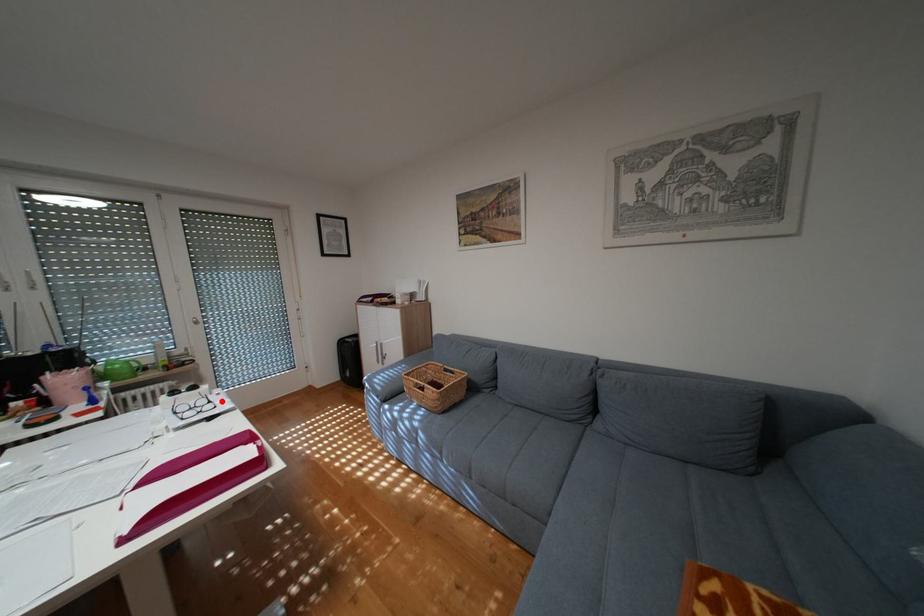
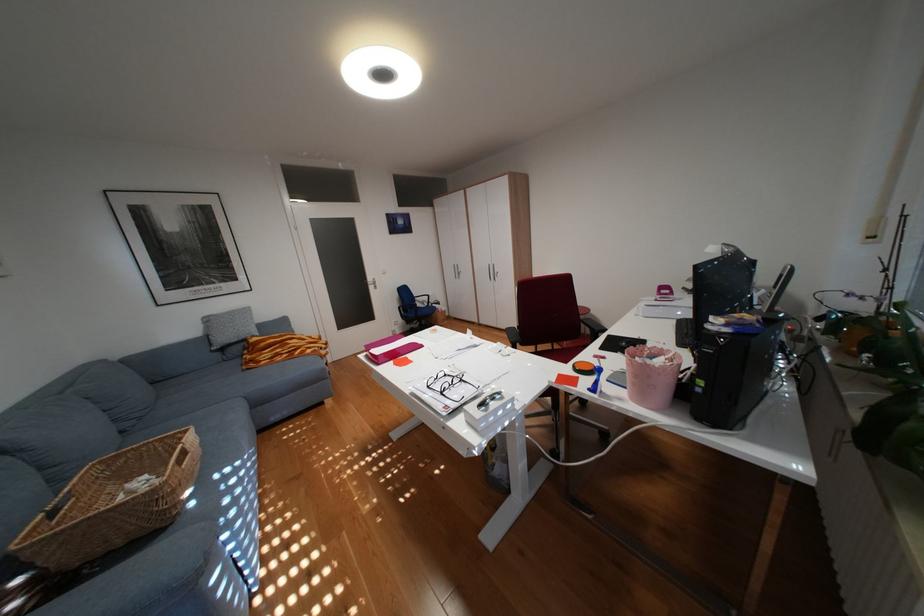
Question: I am providing you with two images of the same scene from different viewpoints. Image1 has a red point marked. In image2, the corresponding 3D location appears at what relative position? Reply with the corresponding letter.

Choices:
 (A) Closer
 (B) Farther

Answer: (B)